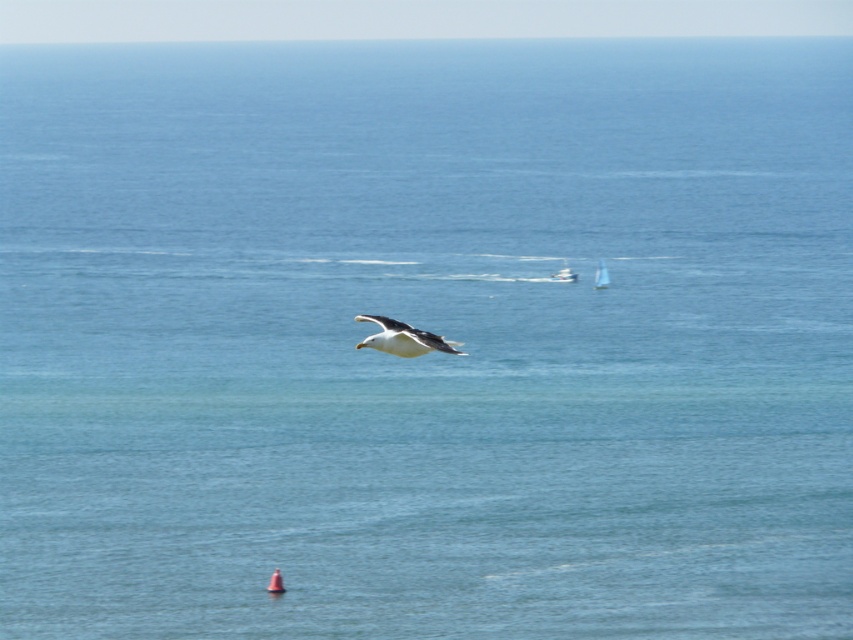
Question: Among these points, which one is farthest from the camera?

Choices:
 (A) (595, 282)
 (B) (415, 348)
 (C) (564, 269)

Answer: (C)

Question: In this image, where is white matte seagull at center located relative to orange buoy at center?

Choices:
 (A) right
 (B) left

Answer: (A)

Question: Does white matte seagull at center appear under orange buoy at center?

Choices:
 (A) no
 (B) yes

Answer: (A)

Question: Considering the relative positions of white matte seagull at center and white sailboat at center in the image provided, where is white matte seagull at center located with respect to white sailboat at center?

Choices:
 (A) right
 (B) left

Answer: (B)

Question: Among these objects, which one is farthest from the camera?

Choices:
 (A) orange buoy at center
 (B) white sailboat at center
 (C) white plastic sailboat at center

Answer: (C)

Question: Which object is the closest to the orange buoy at center?

Choices:
 (A) white sailboat at center
 (B) white matte seagull at center
 (C) white plastic sailboat at center

Answer: (B)